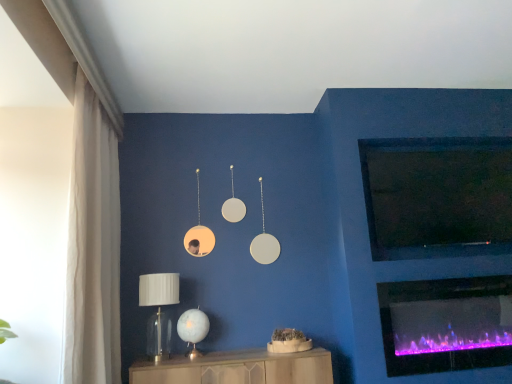
Where is `vacant space situated above purple electric fireplace at lower right (from a real-world perspective)`? The height and width of the screenshot is (384, 512). vacant space situated above purple electric fireplace at lower right (from a real-world perspective) is located at coordinates (446, 272).